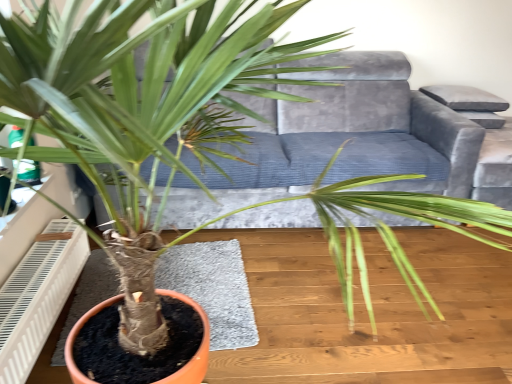
Question: Can you see velvet grey armchair at upper right touching velvet grey couch at center?

Choices:
 (A) no
 (B) yes

Answer: (A)

Question: Can you confirm if velvet grey armchair at upper right is thinner than velvet grey couch at center?

Choices:
 (A) yes
 (B) no

Answer: (A)

Question: Are velvet grey armchair at upper right and velvet grey couch at center far apart?

Choices:
 (A) no
 (B) yes

Answer: (A)

Question: Is velvet grey armchair at upper right shorter than velvet grey couch at center?

Choices:
 (A) yes
 (B) no

Answer: (A)

Question: Is velvet grey armchair at upper right looking in the opposite direction of velvet grey couch at center?

Choices:
 (A) no
 (B) yes

Answer: (A)

Question: Considering their positions, is white plastic air conditioner at lower left located in front of or behind velvet grey couch at center?

Choices:
 (A) front
 (B) behind

Answer: (A)

Question: Considering the positions of white plastic air conditioner at lower left and velvet grey couch at center in the image, is white plastic air conditioner at lower left bigger or smaller than velvet grey couch at center?

Choices:
 (A) small
 (B) big

Answer: (A)

Question: From their relative heights in the image, would you say white plastic air conditioner at lower left is taller or shorter than velvet grey couch at center?

Choices:
 (A) tall
 (B) short

Answer: (B)

Question: From the image's perspective, is white plastic air conditioner at lower left above or below velvet grey couch at center?

Choices:
 (A) above
 (B) below

Answer: (B)

Question: Does point (494, 188) appear closer or farther from the camera than point (31, 256)?

Choices:
 (A) closer
 (B) farther

Answer: (B)

Question: Is velvet grey armchair at upper right taller or shorter than white plastic air conditioner at lower left?

Choices:
 (A) tall
 (B) short

Answer: (A)

Question: Is velvet grey armchair at upper right in front of or behind white plastic air conditioner at lower left in the image?

Choices:
 (A) behind
 (B) front

Answer: (A)

Question: Looking at the image, does velvet grey armchair at upper right seem bigger or smaller compared to white plastic air conditioner at lower left?

Choices:
 (A) small
 (B) big

Answer: (B)

Question: In terms of width, does velvet grey armchair at upper right look wider or thinner when compared to velvet grey couch at center?

Choices:
 (A) wide
 (B) thin

Answer: (B)

Question: Is point (498, 140) closer or farther from the camera than point (314, 173)?

Choices:
 (A) farther
 (B) closer

Answer: (A)